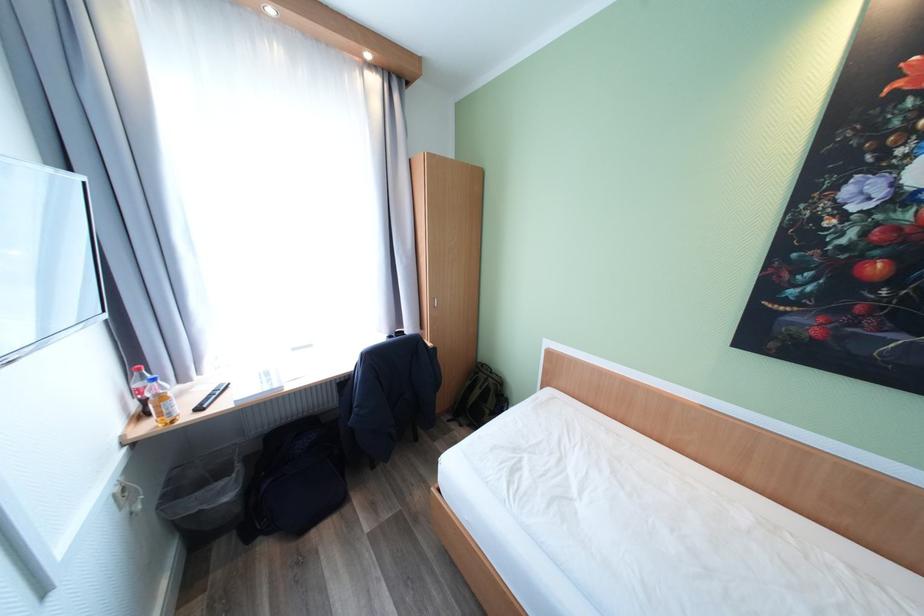
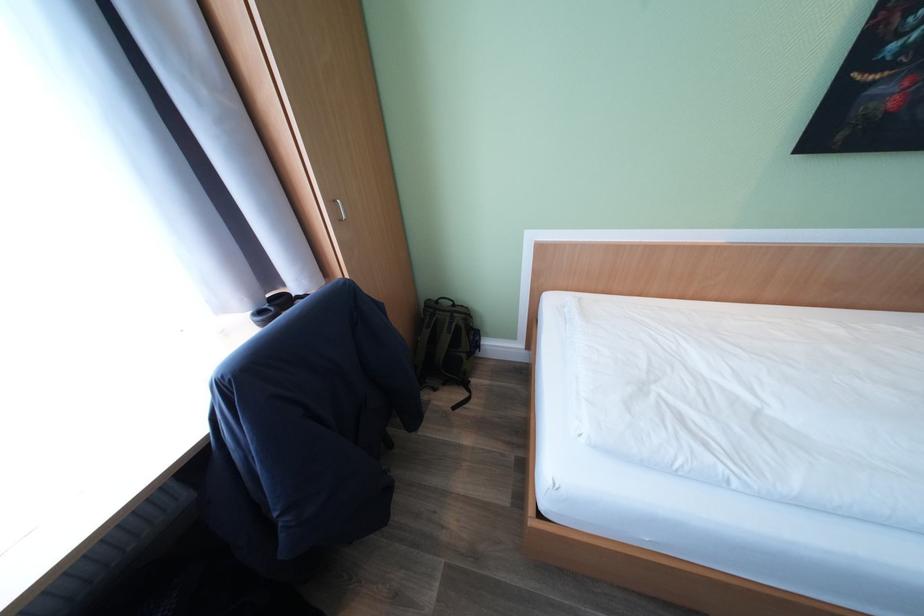
Based on the continuous images, in which direction is the camera rotating?

The rotation direction of the camera is right-down.